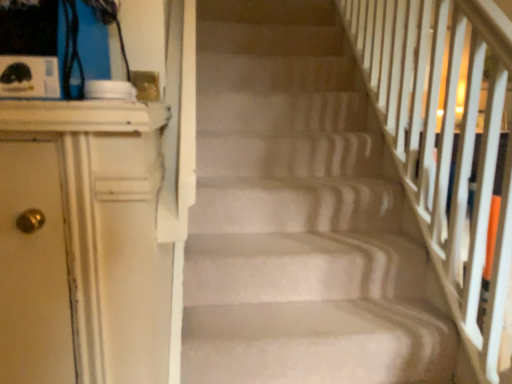
Measure the distance between point (30, 106) and camera.

26.18 inches.

Locate an element on the screen. This screenshot has width=512, height=384. white wood balustrade at upper left is located at coordinates (82, 116).

Describe the element at coordinates (82, 116) in the screenshot. Image resolution: width=512 pixels, height=384 pixels. I see `white wood balustrade at upper left` at that location.

Where is `white wood balustrade at upper left`? The width and height of the screenshot is (512, 384). white wood balustrade at upper left is located at coordinates (82, 116).